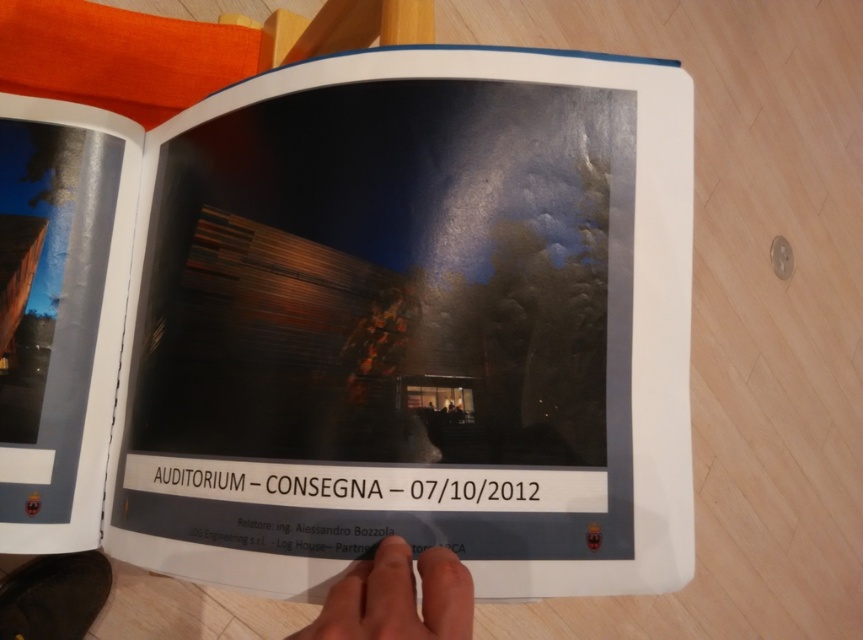
Can you confirm if matte paper book at center is wider than matte skin hand at lower center?

Yes.

Identify the location of matte paper book at center. (413, 324).

Which of these two, matte paper book at center or skin-toned hand at lower center, stands taller?

With more height is matte paper book at center.

Does matte paper book at center come behind skin-toned hand at lower center?

No, matte paper book at center is in front of skin-toned hand at lower center.

Identify the location of matte paper book at center. The width and height of the screenshot is (863, 640). (413, 324).

Between point (362, 624) and point (376, 630), which one is positioned behind?

Point (362, 624)

Can you confirm if skin-toned hand at lower center is taller than matte skin hand at lower center?

Yes.

Between point (386, 600) and point (351, 630), which one is positioned behind?

Positioned behind is point (386, 600).

You are a GUI agent. You are given a task and a screenshot of the screen. Output one action in this format:
    pyautogui.click(x=<x>, y=<y>)
    Task: Click on the skin-toned hand at lower center
    The height and width of the screenshot is (640, 863).
    Given the screenshot: What is the action you would take?
    pyautogui.click(x=397, y=598)